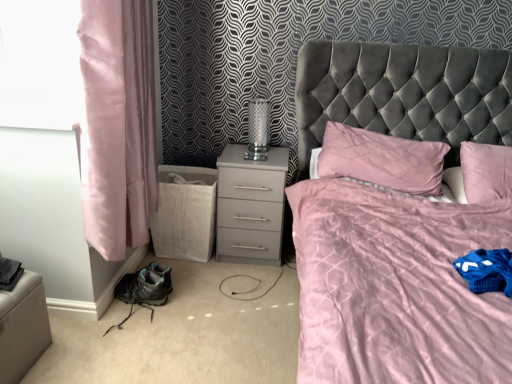
Measure the distance between point (141, 64) and camera.

They are 1.90 meters apart.

Identify the location of matte gray nightstand at center. (250, 206).

What do you see at coordinates (250, 206) in the screenshot? I see `matte gray nightstand at center` at bounding box center [250, 206].

Measure the distance between velvet grey bed at center and camera.

velvet grey bed at center is 3.30 feet away from camera.

In order to click on pink satin pillow at center in this screenshot , I will do `click(382, 159)`.

Is matte gray nightstand at center oriented away from velvet grey bed at center?

No, matte gray nightstand at center is not facing away from velvet grey bed at center.

Who is bigger, matte gray nightstand at center or velvet grey bed at center?

Bigger between the two is velvet grey bed at center.

Looking at this image, is matte gray nightstand at center closer to camera compared to velvet grey bed at center?

That is False.

Are matte gray nightstand at center and velvet grey bed at center located far from each other?

No, matte gray nightstand at center is not far from velvet grey bed at center.

Is pink satin curtain at left wider than velvet grey bed at center?

No.

Is pink satin curtain at left aimed at velvet grey bed at center?

Yes, pink satin curtain at left faces towards velvet grey bed at center.

From a real-world perspective, is pink satin curtain at left on velvet grey bed at center?

Yes, from a real-world perspective, pink satin curtain at left is on top of velvet grey bed at center.

Which point is more distant from viewer, (84, 31) or (347, 111)?

The point (347, 111) is more distant.

Is velvet grey bed at center oriented away from matte gray nightstand at center?

No.

From the image's perspective, is velvet grey bed at center on top of matte gray nightstand at center?

Actually, velvet grey bed at center appears below matte gray nightstand at center in the image.

Find the location of `bed located on the right of matte gray nightstand at center`. bed located on the right of matte gray nightstand at center is located at coordinates (397, 286).

Which object is closer to the camera taking this photo, velvet grey bed at center or matte gray nightstand at center?

velvet grey bed at center is more forward.

Which is in front, clear glass table lamp at center or pink satin curtain at left?

pink satin curtain at left is in front.

Is clear glass table lamp at center oriented away from pink satin curtain at left?

No, pink satin curtain at left is not at the back of clear glass table lamp at center.

Is clear glass table lamp at center bigger or smaller than pink satin curtain at left?

clear glass table lamp at center is smaller than pink satin curtain at left.

You are a GUI agent. You are given a task and a screenshot of the screen. Output one action in this format:
    pyautogui.click(x=<x>, y=<y>)
    Task: Click on the curtain on the left of clear glass table lamp at center
    This screenshot has height=384, width=512.
    Given the screenshot: What is the action you would take?
    pyautogui.click(x=118, y=124)

From a real-world perspective, does pink satin pillow at center stand above pink satin curtain at left?

No, from a real-world perspective, pink satin pillow at center is not over pink satin curtain at left

What's the angular difference between pink satin pillow at center and pink satin curtain at left's facing directions?

89.1 degrees separate the facing orientations of pink satin pillow at center and pink satin curtain at left.

Is the position of pink satin pillow at center more distant than that of pink satin curtain at left?

Yes, it is behind pink satin curtain at left.

Is pink satin pillow at center at the right side of pink satin curtain at left?

Correct, you'll find pink satin pillow at center to the right of pink satin curtain at left.

Between velvet grey bed at center and pink satin pillow at center, which one has larger width?

velvet grey bed at center is wider.

Considering the positions of objects velvet grey bed at center and pink satin pillow at center in the image provided, who is more to the left, velvet grey bed at center or pink satin pillow at center?

pink satin pillow at center is more to the left.

Considering the sizes of objects velvet grey bed at center and pink satin pillow at center in the image provided, who is shorter, velvet grey bed at center or pink satin pillow at center?

pink satin pillow at center is shorter.

Considering the sizes of objects velvet grey bed at center and pink satin pillow at center in the image provided, who is smaller, velvet grey bed at center or pink satin pillow at center?

pink satin pillow at center is smaller.

Is pink satin curtain at left thinner than clear glass table lamp at center?

No.

Do you think pink satin curtain at left is within clear glass table lamp at center, or outside of it?

pink satin curtain at left exists outside the volume of clear glass table lamp at center.

Considering the positions of objects pink satin curtain at left and clear glass table lamp at center in the image provided, who is more to the right, pink satin curtain at left or clear glass table lamp at center?

clear glass table lamp at center.

Where is `nightstand on the left of velvet grey bed at center`? The width and height of the screenshot is (512, 384). nightstand on the left of velvet grey bed at center is located at coordinates (250, 206).

In the image, there is a pink satin curtain at left. Where is `bed below it (from a real-world perspective)`? The width and height of the screenshot is (512, 384). bed below it (from a real-world perspective) is located at coordinates (397, 286).

Looking at this image, when comparing their distances from pink satin curtain at left, does matte gray nightstand at center or velvet grey bed at center seem closer?

Based on the image, matte gray nightstand at center appears to be nearer to pink satin curtain at left.

Looking at this image, based on their spatial positions, is clear glass table lamp at center or velvet grey bed at center closer to matte gray nightstand at center?

clear glass table lamp at center lies closer to matte gray nightstand at center than the other object.

Looking at the image, which one is located further to clear glass table lamp at center, matte gray nightstand at center or pink satin pillow at center?

pink satin pillow at center.

Considering their positions, is pink satin curtain at left positioned further to pink satin pillow at center than matte gray nightstand at center?

pink satin curtain at left is further to pink satin pillow at center.

Which object lies further to the anchor point velvet grey bed at center, pink satin curtain at left or matte gray nightstand at center?

Among the two, pink satin curtain at left is located further to velvet grey bed at center.

Based on the photo, looking at the image, which one is located closer to clear glass table lamp at center, matte gray nightstand at center or velvet grey bed at center?

matte gray nightstand at center lies closer to clear glass table lamp at center than the other object.

Which object lies nearer to the anchor point velvet grey bed at center, clear glass table lamp at center or pink satin curtain at left?

clear glass table lamp at center lies closer to velvet grey bed at center than the other object.

Which object lies further to the anchor point matte gray nightstand at center, velvet grey bed at center or pink satin curtain at left?

Based on the image, pink satin curtain at left appears to be further to matte gray nightstand at center.

The height and width of the screenshot is (384, 512). I want to click on curtain between velvet grey bed at center and matte gray nightstand at center from front to back, so click(118, 124).

I want to click on pillow between velvet grey bed at center and matte gray nightstand at center from front to back, so click(382, 159).

The image size is (512, 384). Identify the location of curtain between velvet grey bed at center and pink satin pillow at center along the z-axis. (118, 124).

Where is `table lamp between pink satin curtain at left and pink satin pillow at center from left to right`? table lamp between pink satin curtain at left and pink satin pillow at center from left to right is located at coordinates (258, 129).